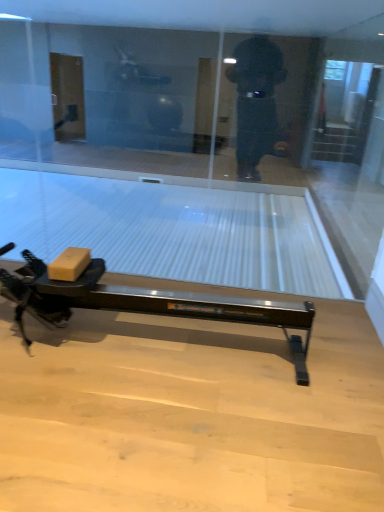
The image size is (384, 512). Describe the element at coordinates (69, 264) in the screenshot. I see `matte cardboard box at lower left` at that location.

You are a GUI agent. You are given a task and a screenshot of the screen. Output one action in this format:
    pyautogui.click(x=<x>, y=<y>)
    Task: Click on the transparent glass at center
    This screenshot has height=512, width=384.
    Given the screenshot: What is the action you would take?
    pyautogui.click(x=193, y=153)

From the picture: Is the position of transparent glass screen door at upper right less distant than that of matte cardboard box at lower left?

No, it is not.

Looking at the image, does transparent glass screen door at upper right seem bigger or smaller compared to matte cardboard box at lower left?

Clearly, transparent glass screen door at upper right is larger in size than matte cardboard box at lower left.

From a real-world perspective, which is physically above, transparent glass screen door at upper right or matte cardboard box at lower left?

transparent glass screen door at upper right, from a real-world perspective.

Does transparent glass screen door at upper right touch matte cardboard box at lower left?

No, transparent glass screen door at upper right is not beside matte cardboard box at lower left.

Considering the relative sizes of transparent glass screen door at upper right and transparent glass at center in the image provided, is transparent glass screen door at upper right bigger than transparent glass at center?

Incorrect, transparent glass screen door at upper right is not larger than transparent glass at center.

Considering the positions of objects transparent glass screen door at upper right and transparent glass at center in the image provided, who is more to the left, transparent glass screen door at upper right or transparent glass at center?

Positioned to the left is transparent glass at center.

Is there a large distance between transparent glass screen door at upper right and transparent glass at center?

That's right, there is a large distance between transparent glass screen door at upper right and transparent glass at center.

Is transparent glass screen door at upper right positioned before transparent glass at center?

No, transparent glass screen door at upper right is further to the viewer.

Is transparent glass at center taller or shorter than matte cardboard box at lower left?

Considering their sizes, transparent glass at center has more height than matte cardboard box at lower left.

Is transparent glass at center bigger than matte cardboard box at lower left?

Indeed, transparent glass at center has a larger size compared to matte cardboard box at lower left.

Is transparent glass at center behind matte cardboard box at lower left?

Yes.

Is transparent glass at center wider or thinner than matte cardboard box at lower left?

transparent glass at center is thinner than matte cardboard box at lower left.

Which object is positioned more to the right, matte cardboard box at lower left or transparent glass at center?

transparent glass at center.

Which object is further away from the camera taking this photo, matte cardboard box at lower left or transparent glass at center?

Positioned behind is transparent glass at center.

Is matte cardboard box at lower left wider than transparent glass at center?

Correct, the width of matte cardboard box at lower left exceeds that of transparent glass at center.

Is matte cardboard box at lower left shorter than transparent glass screen door at upper right?

Yes, matte cardboard box at lower left is shorter than transparent glass screen door at upper right.

From the image's perspective, which object appears higher, matte cardboard box at lower left or transparent glass screen door at upper right?

transparent glass screen door at upper right, from the image's perspective.

Looking at their sizes, would you say matte cardboard box at lower left is wider or thinner than transparent glass screen door at upper right?

Considering their sizes, matte cardboard box at lower left looks broader than transparent glass screen door at upper right.

Which object is closer to the camera, matte cardboard box at lower left or transparent glass screen door at upper right?

matte cardboard box at lower left.

Between transparent glass at center and transparent glass screen door at upper right, which one has less height?

transparent glass at center is shorter.

Is transparent glass screen door at upper right inside transparent glass at center?

No, transparent glass screen door at upper right is not surrounded by transparent glass at center.

Are transparent glass at center and transparent glass screen door at upper right making contact?

No, transparent glass at center is not next to transparent glass screen door at upper right.

The image size is (384, 512). I want to click on screen door lying on the right of matte cardboard box at lower left, so click(x=345, y=111).

The width and height of the screenshot is (384, 512). In order to click on screen door lying above the transparent glass at center (from the image's perspective) in this screenshot , I will do `click(345, 111)`.

Looking at the image, which one is located closer to transparent glass at center, matte cardboard box at lower left or transparent glass screen door at upper right?

matte cardboard box at lower left lies closer to transparent glass at center than the other object.

Which object lies nearer to the anchor point matte cardboard box at lower left, transparent glass at center or transparent glass screen door at upper right?

Based on the image, transparent glass at center appears to be nearer to matte cardboard box at lower left.

Estimate the real-world distances between objects in this image. Which object is further from transparent glass screen door at upper right, matte cardboard box at lower left or transparent glass at center?

Among the two, matte cardboard box at lower left is located further to transparent glass screen door at upper right.

Based on their spatial positions, is transparent glass screen door at upper right or matte cardboard box at lower left closer to transparent glass at center?

matte cardboard box at lower left lies closer to transparent glass at center than the other object.

From the image, which object appears to be farther from transparent glass screen door at upper right, transparent glass at center or matte cardboard box at lower left?

matte cardboard box at lower left is positioned further to the anchor transparent glass screen door at upper right.

Considering their positions, is transparent glass screen door at upper right positioned further to matte cardboard box at lower left than transparent glass at center?

The object further to matte cardboard box at lower left is transparent glass screen door at upper right.

Image resolution: width=384 pixels, height=512 pixels. What are the coordinates of `shop window between matte cardboard box at lower left and transparent glass screen door at upper right in the front-back direction` in the screenshot? It's located at 193,153.